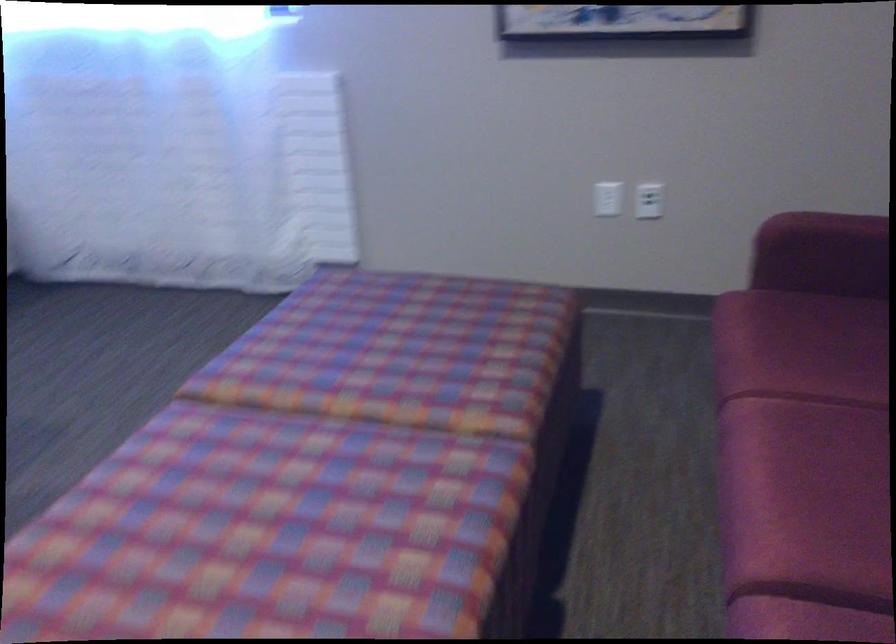
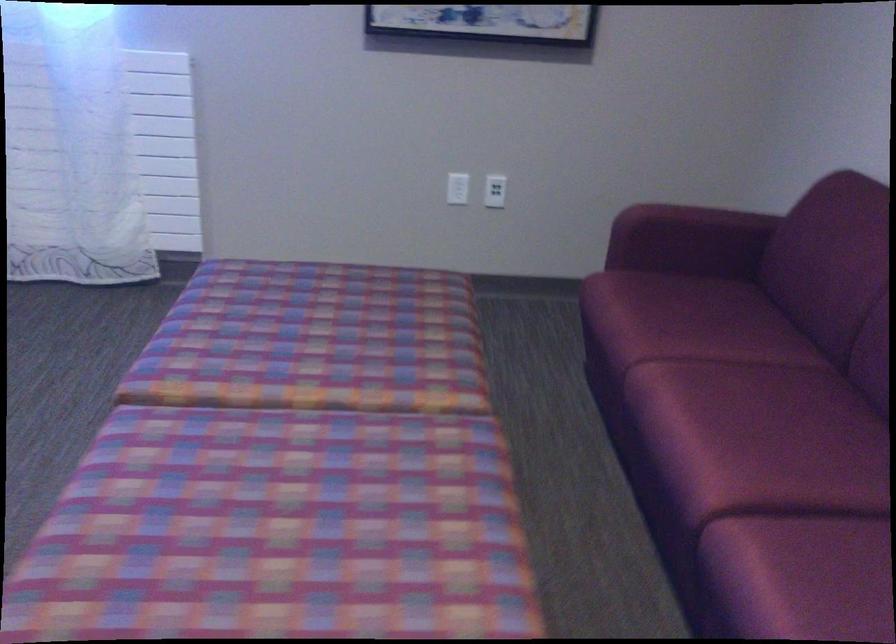
Find the pixel in the second image that matches pixel 642 200 in the first image.

(495, 191)